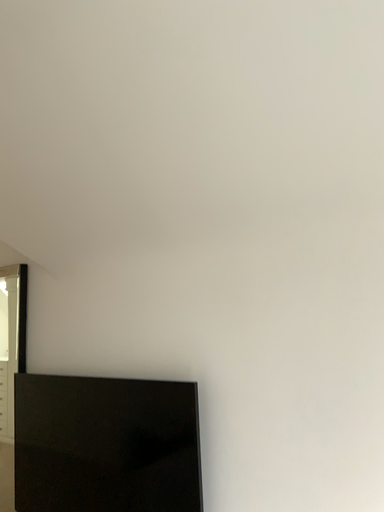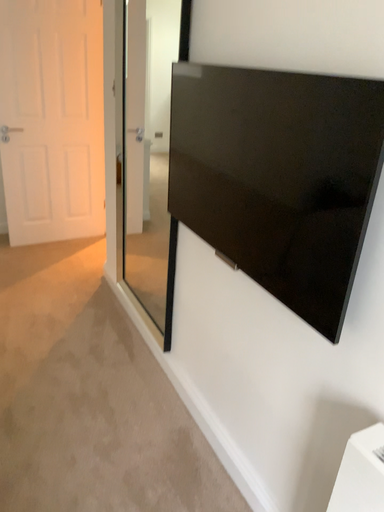
Question: Which way did the camera rotate in the video?

Choices:
 (A) rotated downward
 (B) rotated upward

Answer: (A)